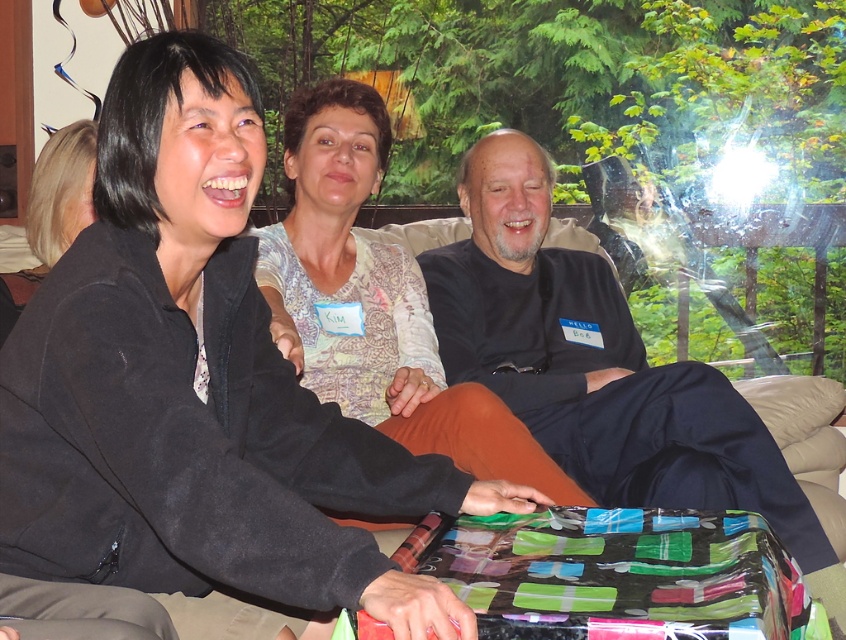
You are a photographer standing in the living room and want to take a picture of the black matte shirt at center and the patterned fabric shirt at center. Which one should you focus on first if you want to capture both shirts clearly in the same frame?

The black matte shirt at center has a greater height compared to the patterned fabric shirt at center, so you should focus on the black matte shirt at center first to ensure both are in focus.

You are standing in the living room and want to reach the point marked as point (485, 236). If your maximum reach is 2 meters, can you touch it without moving closer?

The point (485, 236) is 2.33 meters away from the camera, which is beyond your maximum reach of 2 meters. Therefore, you cannot touch it without moving closer.